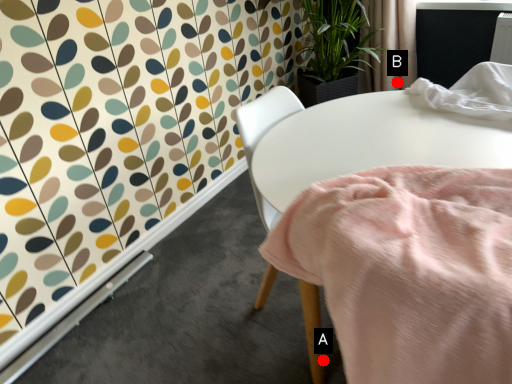
Question: Two points are circled on the image, labeled by A and B beside each circle. Which point appears farthest from the camera in this image?

Choices:
 (A) A is further
 (B) B is further

Answer: (B)